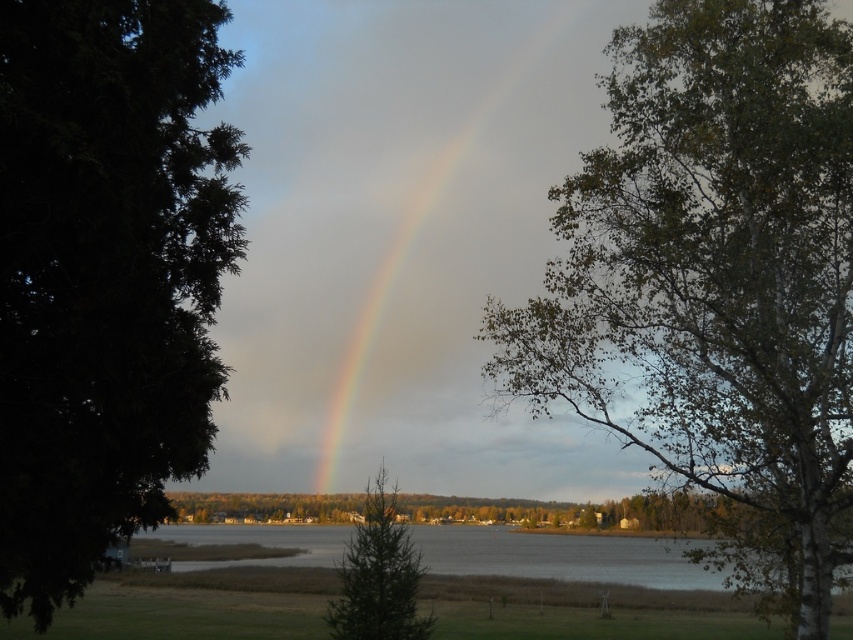
You are standing in the middle of the grassy area in the scene. You want to walk towards the green leafy tree at right. Which direction should you head?

You should head to the right since the green leafy tree at right is located at point (712, 272), which is to the right side of the scene.

You are an artist painting the landscape scene. You want to ensure the rainbow at center and the green matte tree at center are proportionally accurate. Based on the scene, which object should you draw taller?

The rainbow at center should be drawn taller than the green matte tree at center because the rainbow at center is much taller as green matte tree at center.